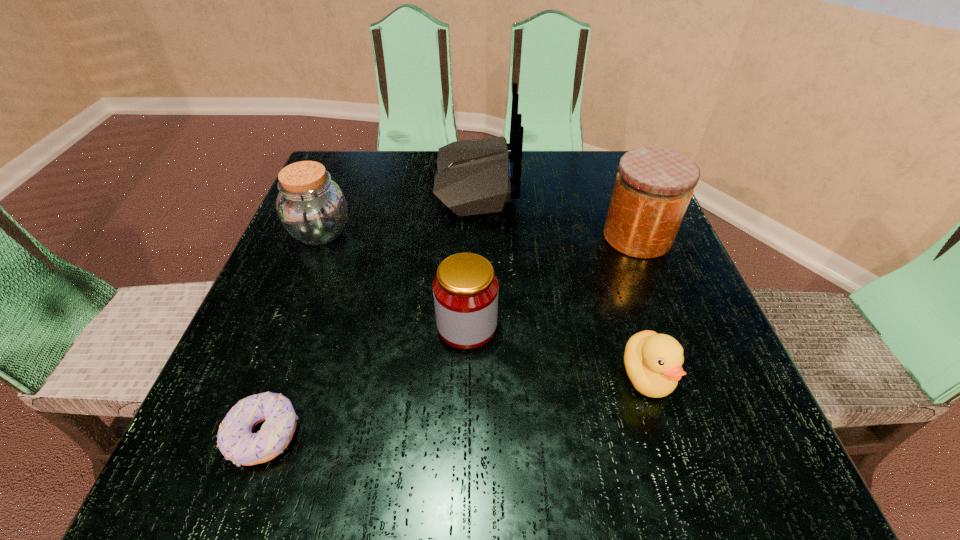
This screenshot has width=960, height=540. Find the location of `router`. router is located at coordinates (473, 177).

The image size is (960, 540). I want to click on the rightmost jar, so click(653, 188).

Where is `the leftmost jar`? The width and height of the screenshot is (960, 540). the leftmost jar is located at coordinates (311, 207).

At what (x,y) coordinates should I click in order to perform the action: click on the nearest jar. Please return your answer as a coordinate pair (x, y). This screenshot has height=540, width=960. Looking at the image, I should click on (465, 289).

In order to click on the fifth tallest object in this screenshot , I will do `click(653, 362)`.

Find the location of a particular element. the shortest object is located at coordinates (237, 442).

Where is `free spot located on the back of the router`? The height and width of the screenshot is (540, 960). free spot located on the back of the router is located at coordinates (589, 183).

This screenshot has height=540, width=960. What are the coordinates of `vacant space located on the front of the rightmost jar` in the screenshot? It's located at (659, 291).

Where is `vacant space located 0.170m on the front of the leftmost jar`? The width and height of the screenshot is (960, 540). vacant space located 0.170m on the front of the leftmost jar is located at coordinates (284, 323).

The height and width of the screenshot is (540, 960). Find the location of `vacant space situated 0.260m on the right of the second jar from left to right`. vacant space situated 0.260m on the right of the second jar from left to right is located at coordinates (655, 326).